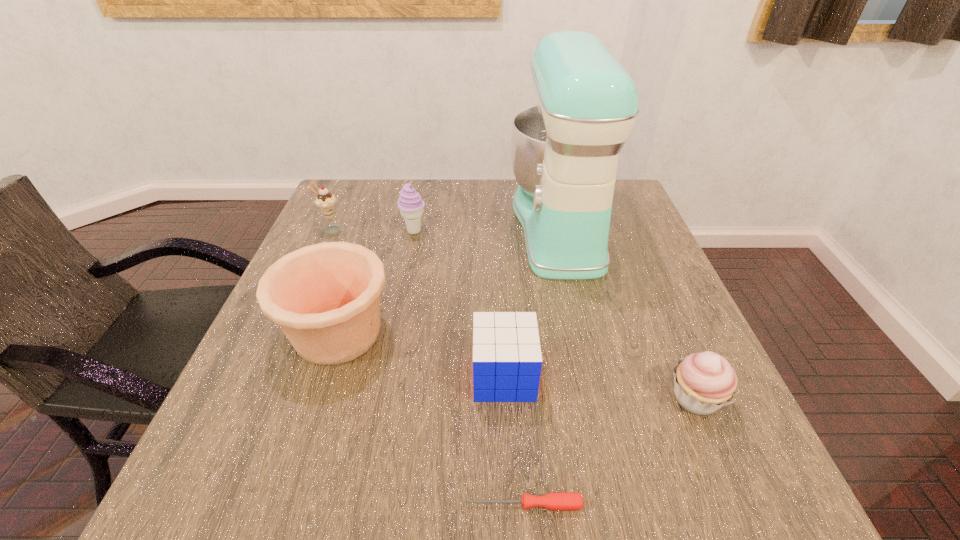
What are the coordinates of `vacant position located 0.130m at the base of the mixer` in the screenshot? It's located at (461, 226).

Locate an element on the screen. free space located on the right of the left icecream is located at coordinates (465, 231).

Find the location of a particular element. The height and width of the screenshot is (540, 960). free space located 0.090m on the front of the pottery is located at coordinates (309, 422).

The width and height of the screenshot is (960, 540). I want to click on vacant space located on the front of the right icecream, so click(x=396, y=328).

Where is `free space located on the left of the cupcake`? free space located on the left of the cupcake is located at coordinates (496, 398).

This screenshot has width=960, height=540. Identify the location of free space located on the left of the cube. point(323,376).

You are a GUI agent. You are given a task and a screenshot of the screen. Output one action in this format:
    pyautogui.click(x=<x>, y=<y>)
    Task: Click on the vacant space situated at the tip of the nearest object
    
    Given the screenshot: What is the action you would take?
    pyautogui.click(x=372, y=504)

Identify the location of vacant space located 0.150m at the tip of the nearest object. (364, 504).

At what (x,y) coordinates should I click in order to perform the action: click on free spot located 0.370m at the tip of the nearest object. Please return your answer as a coordinate pair (x, y). Looking at the image, I should click on (214, 504).

The height and width of the screenshot is (540, 960). Identify the location of object that is at the far edge. (564, 152).